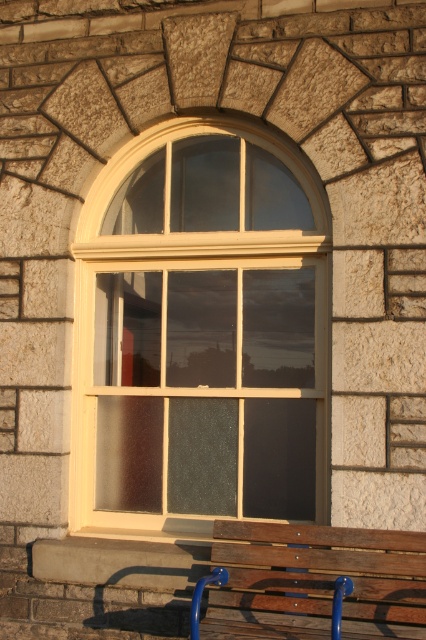
You are sitting on the wooden bench at lower center and want to look through the matte cream window at center. Can you see through the window from your current position?

The wooden bench at lower center is behind the matte cream window at center, so you are positioned behind the window and cannot see through it from your current position.

You are an interior designer planning to place a new sofa in the living room. The sofa must be positioned so that it faces the matte cream window at center. Given that the wooden bench at lower center is currently blocking the view, can the sofa be placed in front of the window without moving the bench?

The matte cream window at center is bigger than the wooden bench at lower center. Since the bench is smaller, it might not fully block the view of the entire window. However, the exact positioning would depend on the bench placement. To ensure the sofa has an unobstructed view, consider moving the bench or placing the sofa to the side of the bench where the window extends beyond the bench.

You are standing in a garden and see the matte cream window at center and the wooden bench at lower center. Which object is positioned to the right side of the other?

The wooden bench at lower center is positioned to the right of the matte cream window at center.